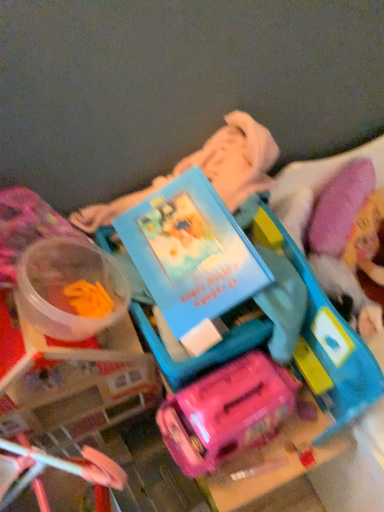
Question: Considering the positions of translucent plastic container at left, which is counted as the 2th toy, starting from the right, and matte plastic suitcase at center, which is the second toy from left to right, in the image, is translucent plastic container at left, which is counted as the 2th toy, starting from the right, bigger or smaller than matte plastic suitcase at center, which is the second toy from left to right,?

Choices:
 (A) small
 (B) big

Answer: (A)

Question: Considering the positions of translucent plastic container at left, which is counted as the 2th toy, starting from the right, and matte plastic suitcase at center, the first toy in the right-to-left sequence, in the image, is translucent plastic container at left, which is counted as the 2th toy, starting from the right, wider or thinner than matte plastic suitcase at center, the first toy in the right-to-left sequence,?

Choices:
 (A) thin
 (B) wide

Answer: (A)

Question: Which object is positioned farthest from the matte blue book at center?

Choices:
 (A) translucent plastic container at left, which is counted as the 2th toy, starting from the right
 (B) matte plastic suitcase at center, which is the second toy from left to right

Answer: (B)

Question: Which of these objects is positioned closest to the matte blue book at center?

Choices:
 (A) matte plastic suitcase at center, the first toy in the right-to-left sequence
 (B) translucent plastic container at left, arranged as the 1th toy when viewed from the left

Answer: (B)